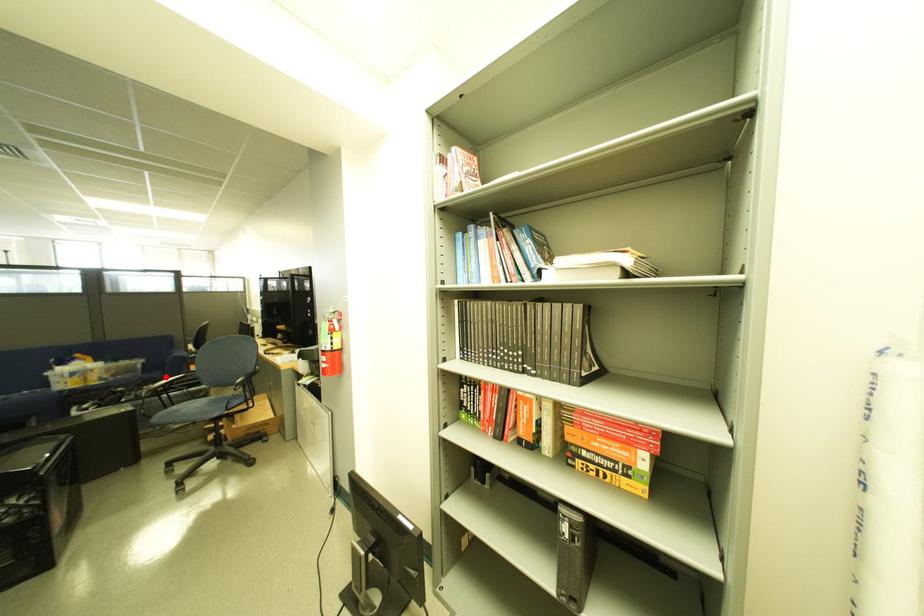
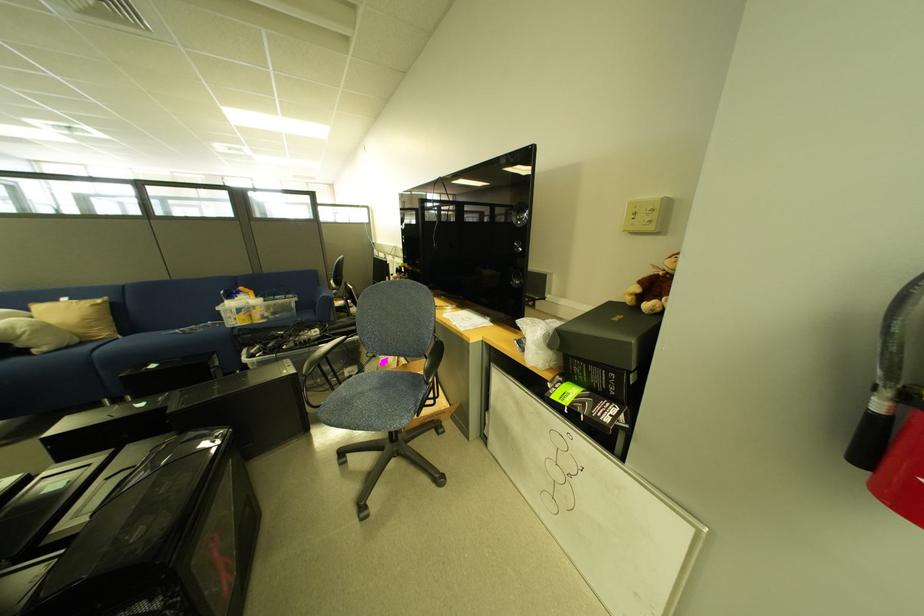
Where in the second image is the point corresponding to the highlighted location from the first image?

(319, 318)